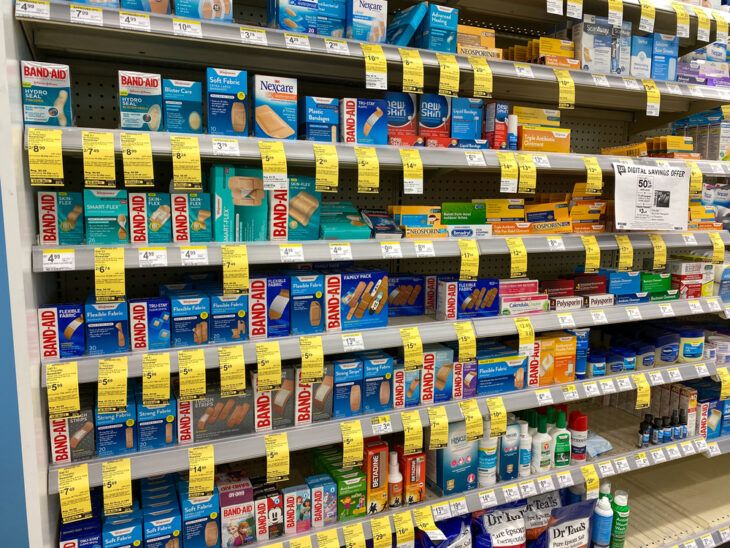
The height and width of the screenshot is (548, 730). What are the coordinates of `wall beside shelves` in the screenshot? It's located at (18, 436).